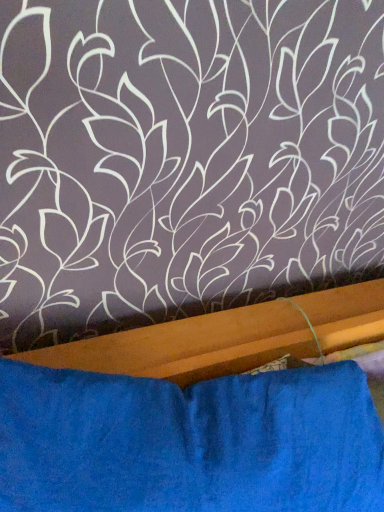
Identify the location of wooden hanger at center. The width and height of the screenshot is (384, 512). coord(200,416).

This screenshot has width=384, height=512. Describe the element at coordinates (200, 416) in the screenshot. I see `wooden hanger at center` at that location.

I want to click on wooden hanger at center, so click(200, 416).